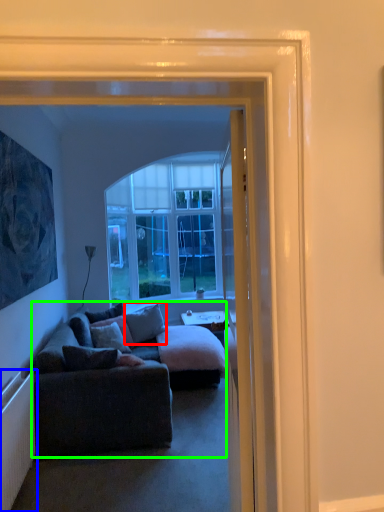
Question: Which object is positioned closest to pillow (highlighted by a red box)? Select from radiator (highlighted by a blue box) and studio couch (highlighted by a green box).

Choices:
 (A) radiator
 (B) studio couch

Answer: (B)